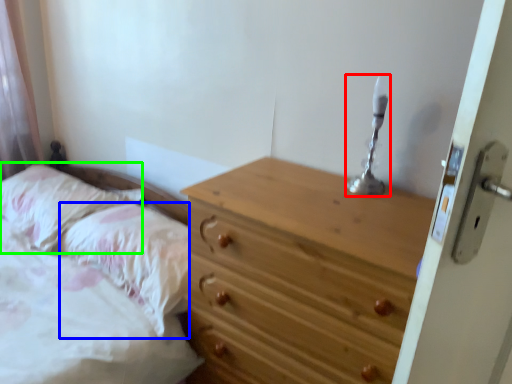
Question: Which is farther away from candle holder (highlighted by a red box)? pillow (highlighted by a blue box) or pillow (highlighted by a green box)?

Choices:
 (A) pillow
 (B) pillow

Answer: (B)